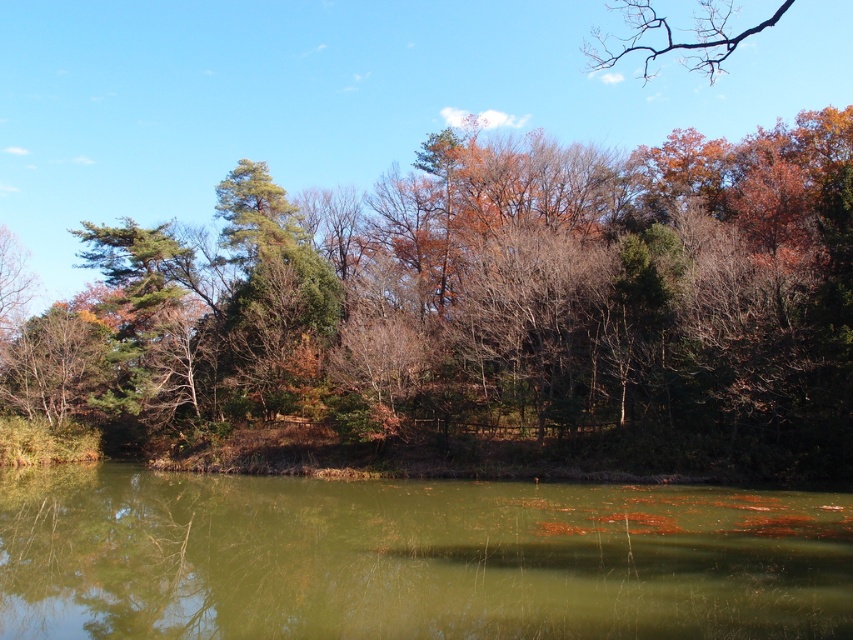
Question: Does green leafy tree at center appear over green murky water at center?

Choices:
 (A) yes
 (B) no

Answer: (A)

Question: Considering the relative positions of green leafy tree at center and green murky water at center in the image provided, where is green leafy tree at center located with respect to green murky water at center?

Choices:
 (A) right
 (B) left

Answer: (A)

Question: Is green leafy tree at center thinner than green murky water at center?

Choices:
 (A) no
 (B) yes

Answer: (A)

Question: Among these points, which one is farthest from the camera?

Choices:
 (A) (843, 129)
 (B) (706, 572)

Answer: (A)